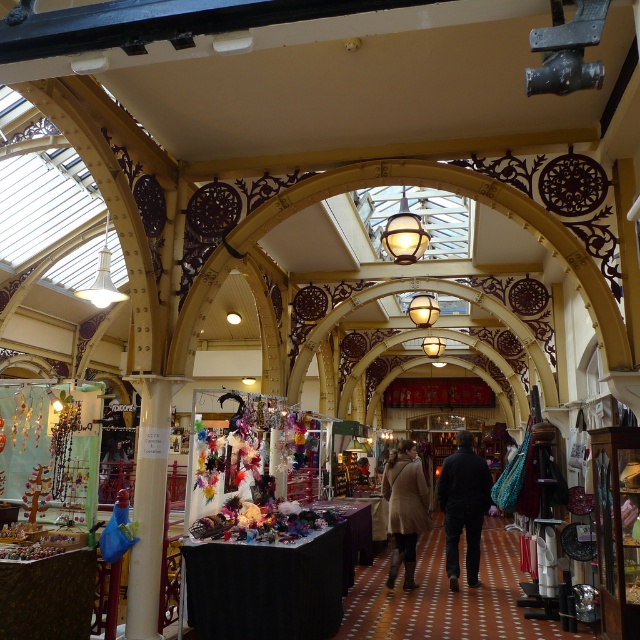
You are a customer in this historic market and want to place a small shopping bag between the dark blue jeans at center and the beige wool coat at center. Can you fit the bag between them?

The dark blue jeans at center has a larger width than the beige wool coat at center, so there might be enough space to fit the small shopping bag between them.